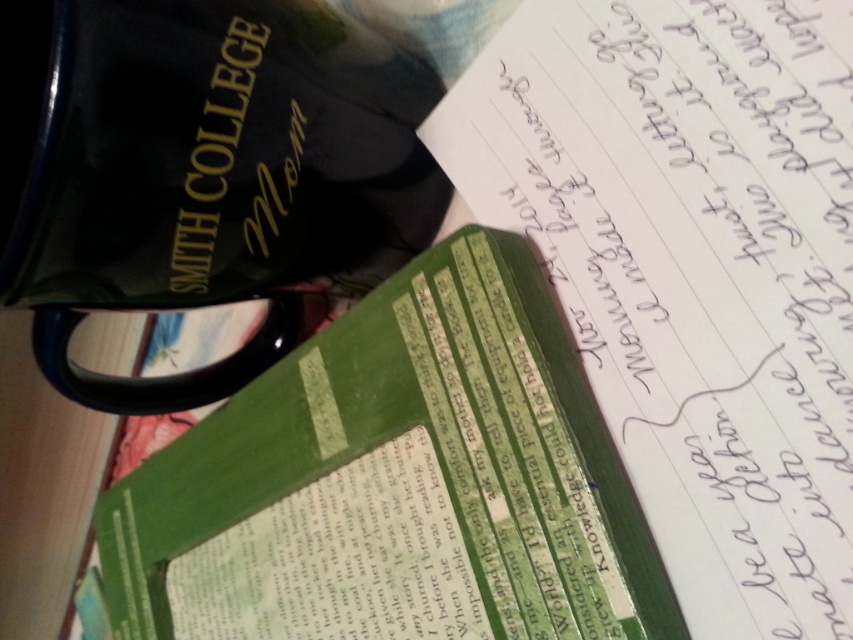
Question: Does green textured notebook at center appear on the left side of green paper notebook at center?

Choices:
 (A) yes
 (B) no

Answer: (B)

Question: Which object appears closest to the camera in this image?

Choices:
 (A) green textured notebook at center
 (B) green paper notebook at center

Answer: (A)

Question: Which point appears closest to the camera in this image?

Choices:
 (A) (735, 435)
 (B) (178, 529)

Answer: (A)

Question: Among these points, which one is nearest to the camera?

Choices:
 (A) (793, 145)
 (B) (543, 282)

Answer: (A)

Question: In this image, where is green textured notebook at center located relative to green paper notebook at center?

Choices:
 (A) above
 (B) below

Answer: (A)

Question: Is green textured notebook at center below green paper notebook at center?

Choices:
 (A) no
 (B) yes

Answer: (A)